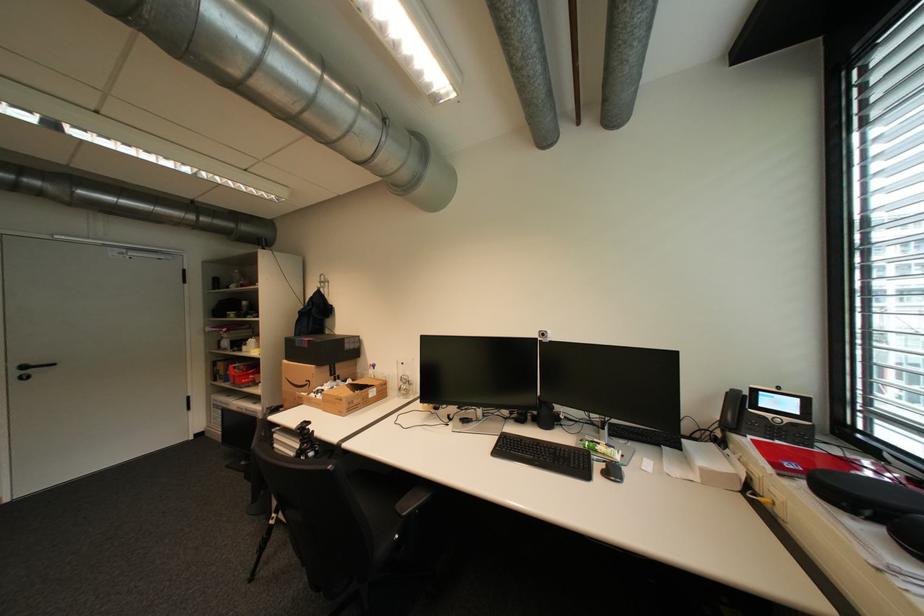
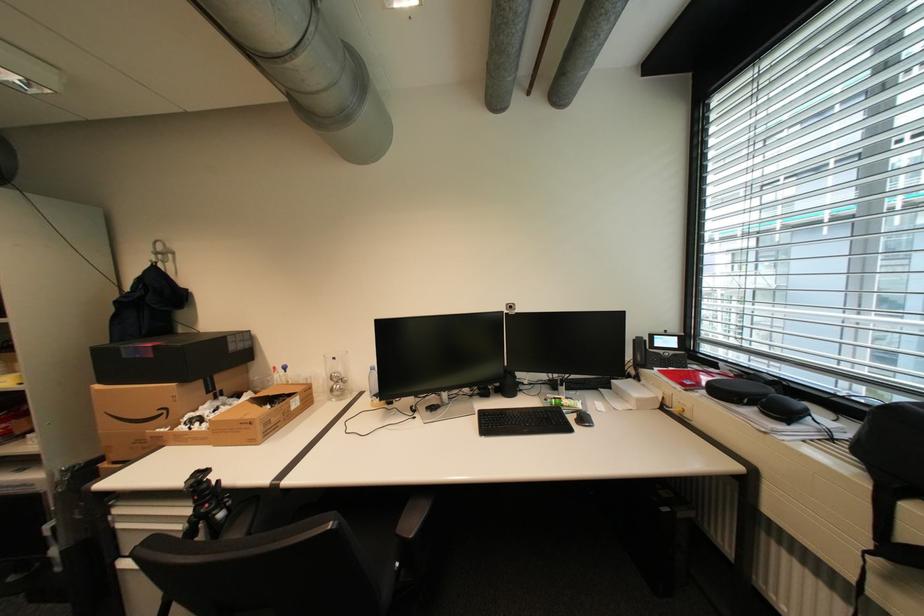
The point at (606, 467) is marked in the first image. Where is the corresponding point in the second image?

(579, 419)